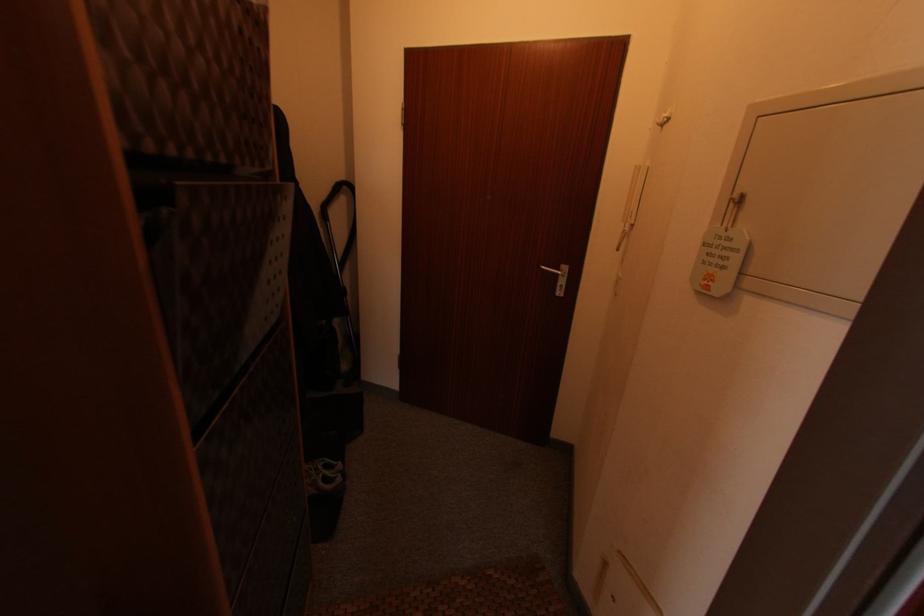
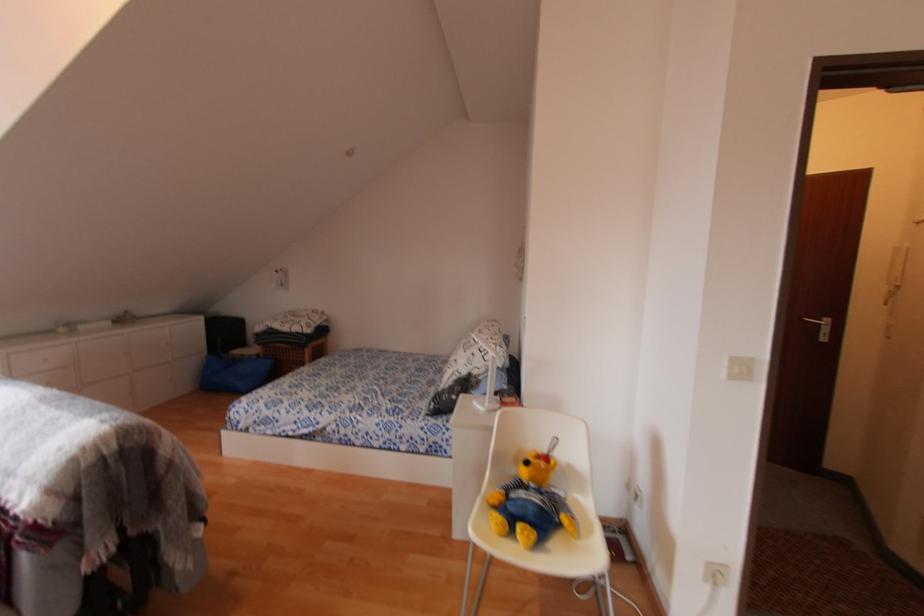
In a continuous first-person perspective shot, in which direction is the camera moving?

The cameraman walked toward left, backward.